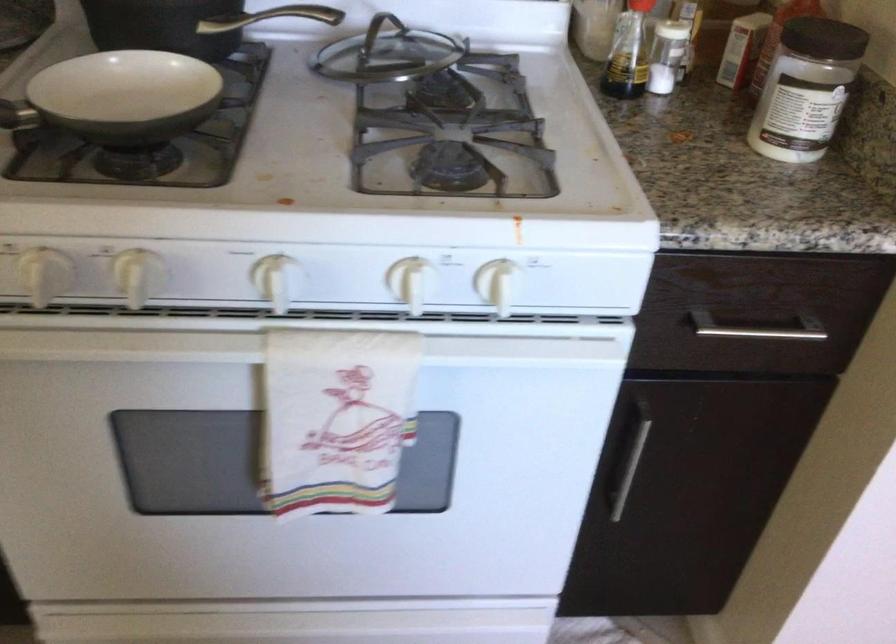
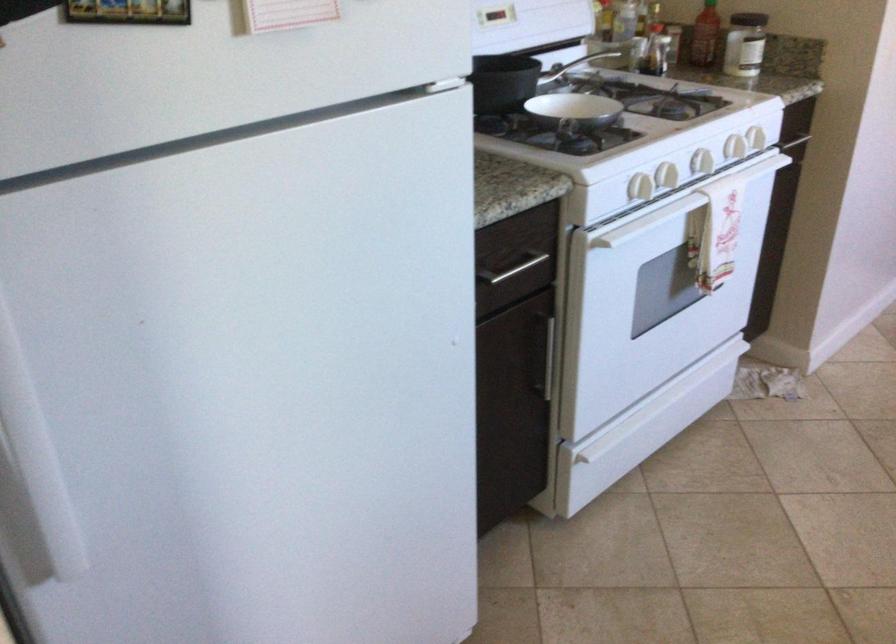
In the second image, find the point that corresponds to (673,126) in the first image.

(704, 35)